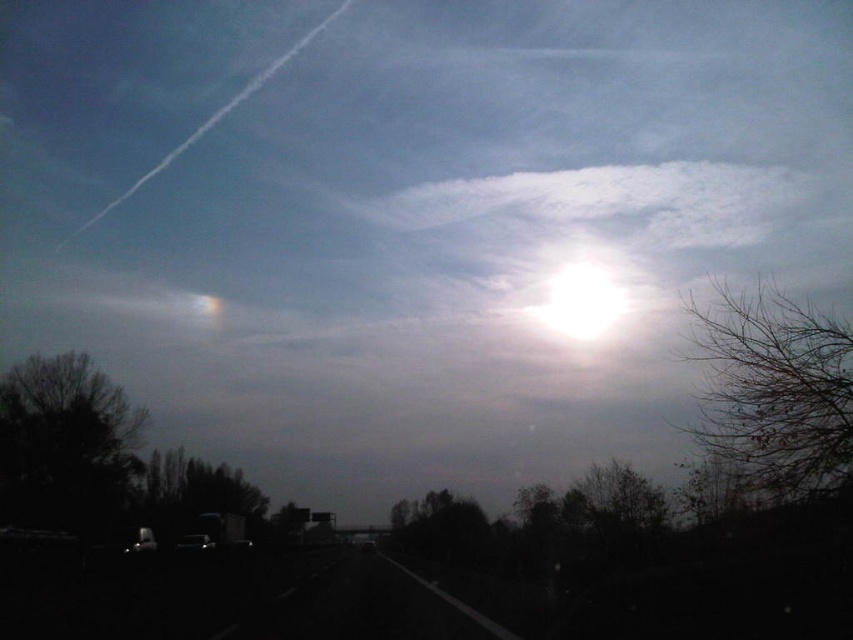
Is bare branches at right shorter than bright white cloud at upper center?

No.

Consider the image. Can you confirm if bare branches at right is positioned above bright white cloud at upper center?

No.

Which is behind, point (730, 452) or point (605, 296)?

The point (605, 296) is more distant.

The image size is (853, 640). Find the location of `bare branches at right`. bare branches at right is located at coordinates (773, 394).

Does dark green leafy tree at left appear under bright white cloud at upper center?

Indeed, dark green leafy tree at left is positioned under bright white cloud at upper center.

Who is more distant from viewer, (112, 417) or (608, 316)?

The point (608, 316) is more distant.

Is point (74, 451) positioned behind point (601, 317)?

No, (74, 451) is in front of (601, 317).

In order to click on dark green leafy tree at left in this screenshot , I will do `click(65, 442)`.

Can you confirm if bare branches at right is thinner than white fluffy cloud at upper center?

Yes, bare branches at right is thinner than white fluffy cloud at upper center.

Does bare branches at right have a smaller size compared to white fluffy cloud at upper center?

Actually, bare branches at right might be larger than white fluffy cloud at upper center.

Measure the distance between bare branches at right and camera.

24.51 meters

This screenshot has width=853, height=640. Identify the location of bare branches at right. (x=773, y=394).